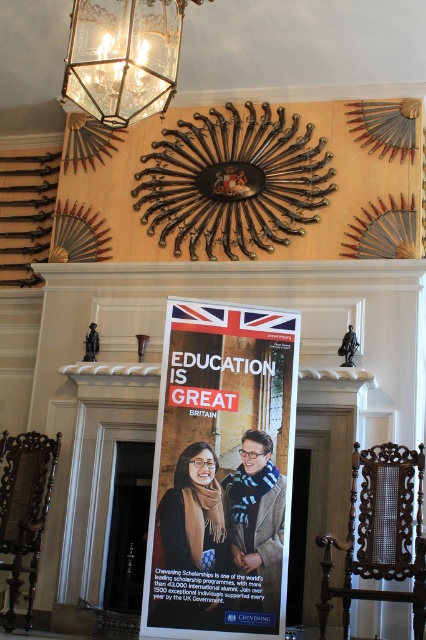
Which is more to the left, white paper poster at center or clear glass lantern at upper center?

From the viewer's perspective, clear glass lantern at upper center appears more on the left side.

Who is higher up, white paper poster at center or clear glass lantern at upper center?

clear glass lantern at upper center is higher up.

Between point (164, 449) and point (115, 58), which one is positioned in front?

Point (115, 58) is more forward.

Find the location of a particular element. The width and height of the screenshot is (426, 640). white paper poster at center is located at coordinates (221, 470).